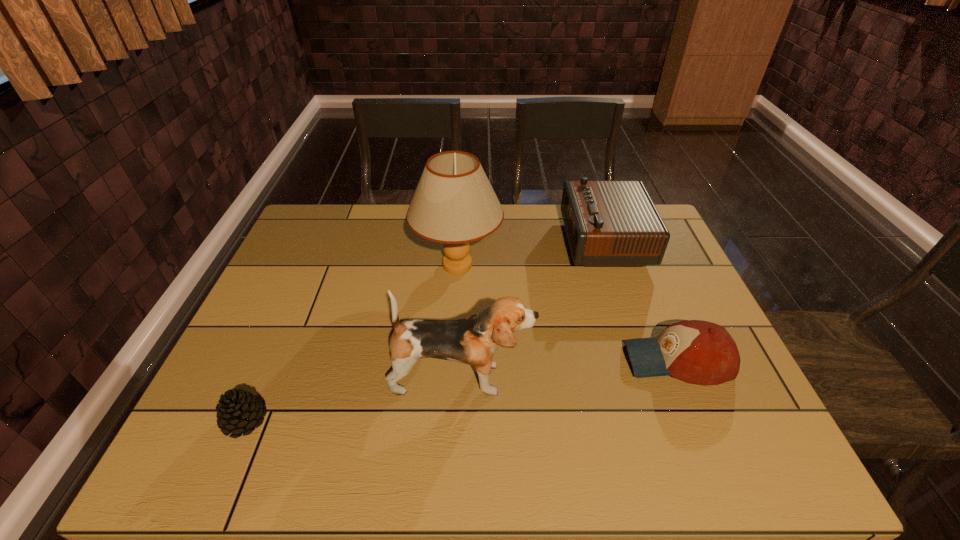
Locate an element on the screen. vacant region located 0.090m on the front panel of the third shortest object is located at coordinates (537, 241).

The width and height of the screenshot is (960, 540). In order to click on free space located 0.240m on the front-facing side of the baseball cap in this screenshot , I will do `click(525, 360)`.

This screenshot has height=540, width=960. In order to click on vacant region located 0.070m on the front-facing side of the baseball cap in this screenshot , I will do `click(596, 360)`.

Identify the location of vacant space located 0.320m on the front-facing side of the baseball cap. (492, 360).

The height and width of the screenshot is (540, 960). In order to click on lampshade that is positioned at the far edge in this screenshot , I will do `click(454, 203)`.

This screenshot has width=960, height=540. Find the location of `radio receiver that is positioned at the far edge`. radio receiver that is positioned at the far edge is located at coordinates (608, 223).

In order to click on object located at the near edge in this screenshot , I will do `click(237, 411)`.

Where is `object positioned at the left edge`? The width and height of the screenshot is (960, 540). object positioned at the left edge is located at coordinates (237, 411).

I want to click on radio receiver that is at the right edge, so click(x=608, y=223).

You are a GUI agent. You are given a task and a screenshot of the screen. Output one action in this format:
    pyautogui.click(x=<x>, y=<y>)
    Task: Click on the baseball cap that is at the right edge
    The width and height of the screenshot is (960, 540).
    Given the screenshot: What is the action you would take?
    pyautogui.click(x=698, y=352)